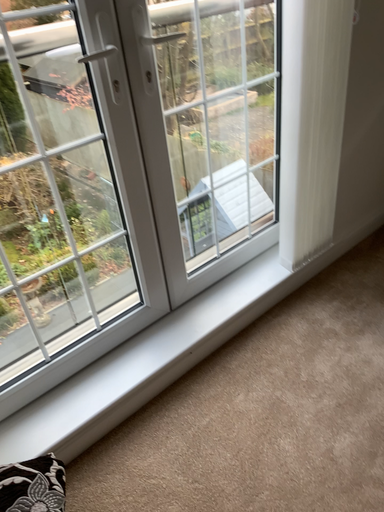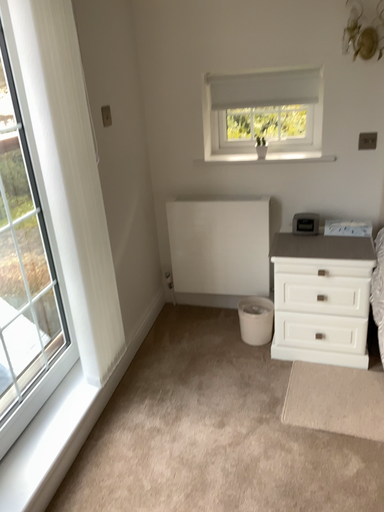
Question: Which way did the camera rotate in the video?

Choices:
 (A) rotated left
 (B) rotated right

Answer: (B)